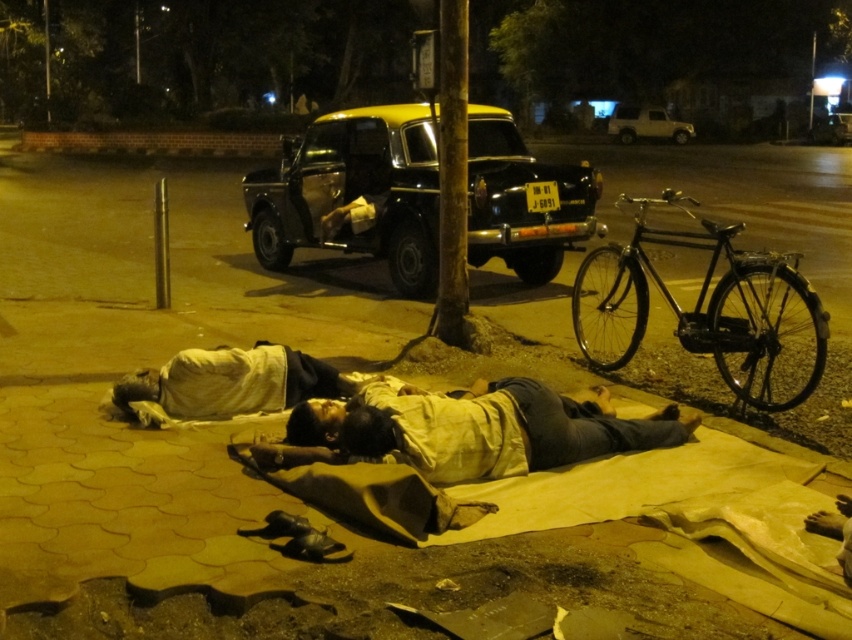
You are a delivery person who needs to place a package on the light beige fabric at lower center. However, the yellow painted metal taxi at center is blocking the way. Can you still place the package there without moving the taxi?

The yellow painted metal taxi at center is much taller than the light beige fabric at lower center, so you can place the package on the light beige fabric at lower center by going around the taxi since the taxi is taller but not necessarily blocking the path.

You are standing at the point marked by the coordinates point (471, 429) in the image. Looking around, you see the light beige fabric at lower center and the bicycle leaning against the tree trunk to the right of the individuals. Which object is closer to you?

The light beige fabric at lower center is closer to you because the point marks its location, meaning you are standing directly on it, while the bicycle is positioned to the right of the individuals who are further away from the camera.